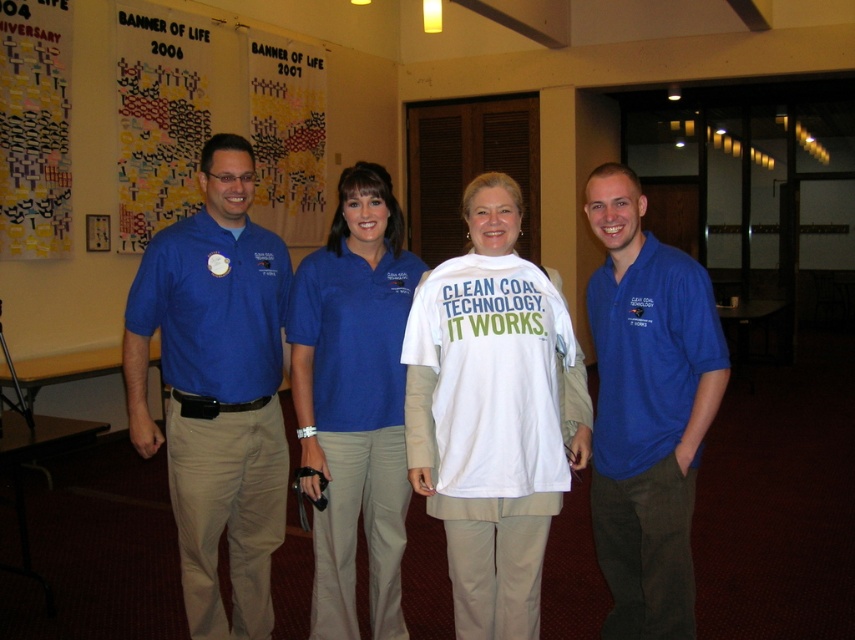
You are standing in the conference room and see a point marked at coordinate (647, 410). Which object is this point located on?

The point at coordinate (647, 410) is located on the matte blue polo shirt at right.

You are a photographer at the event and need to adjust the spacing between the two people wearing the matte blue polo shirt at right and the matte blue polo shirt at center so that they are exactly 30 inches apart. How much distance should each person move, and in which direction?

The matte blue polo shirt at right and matte blue polo shirt at center are currently 28.88 inches apart. To reach 30 inches, they need an additional 1.12 inches between them. Each person should move 0.56 inches away from each other. The person in the right should move to the right, and the person in the center should move to the left.